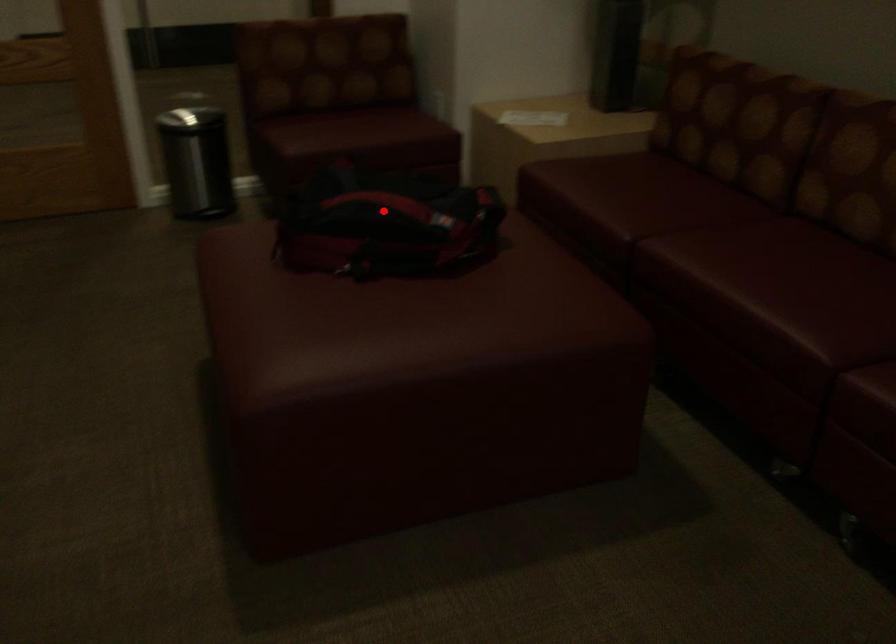
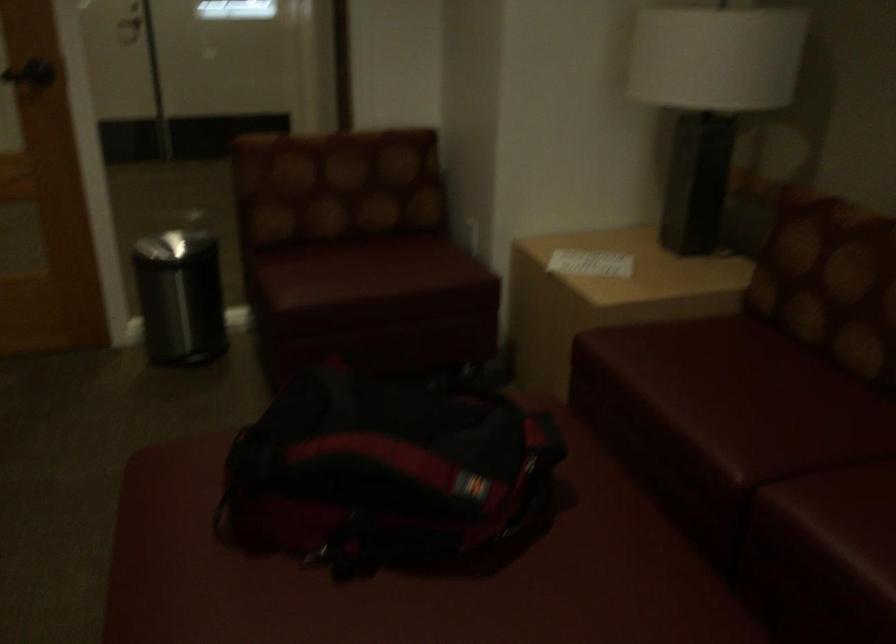
Question: I am providing you with two images of the same scene from different viewpoints. Image1 has a red point marked. In image2, the corresponding 3D location appears at what relative position? Reply with the corresponding letter.

Choices:
 (A) Closer
 (B) Farther

Answer: (A)